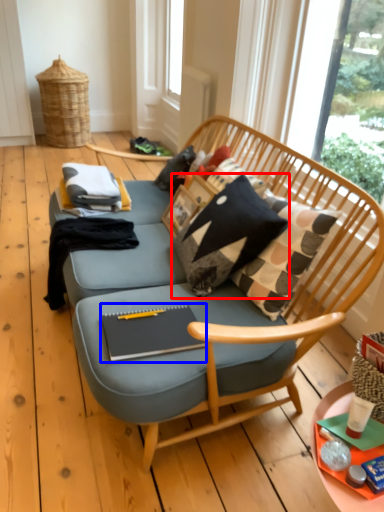
Question: Which of the following is the farthest to the observer, pillow (highlighted by a red box) or magazine (highlighted by a blue box)?

Choices:
 (A) pillow
 (B) magazine

Answer: (A)